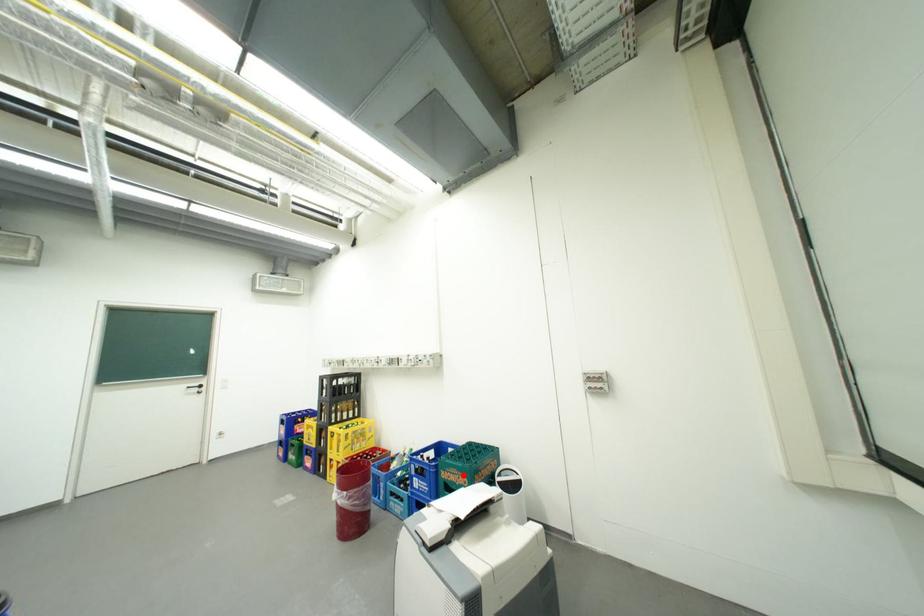
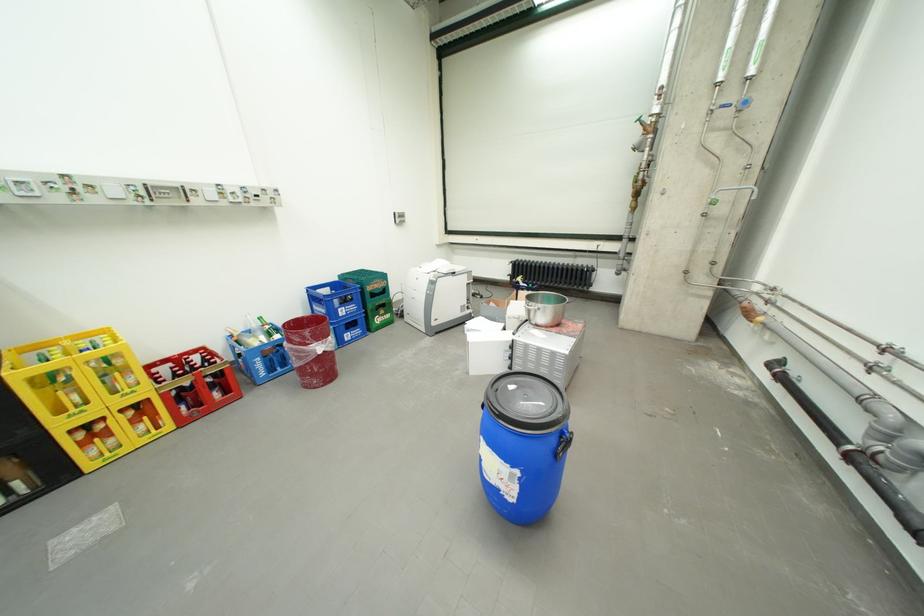
In the second image, find the point that corresponds to the highlighted location in the first image.

(386, 285)